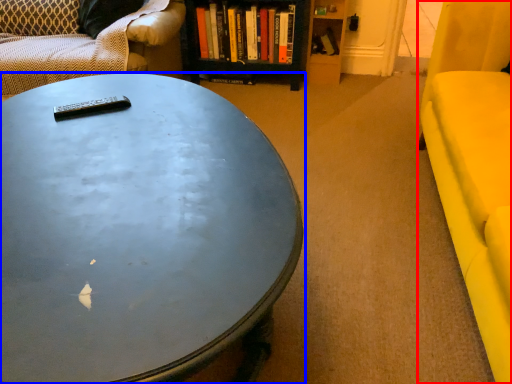
Question: Which object appears farthest to the camera in this image, armchair (highlighted by a red box) or coffee table (highlighted by a blue box)?

Choices:
 (A) armchair
 (B) coffee table

Answer: (A)